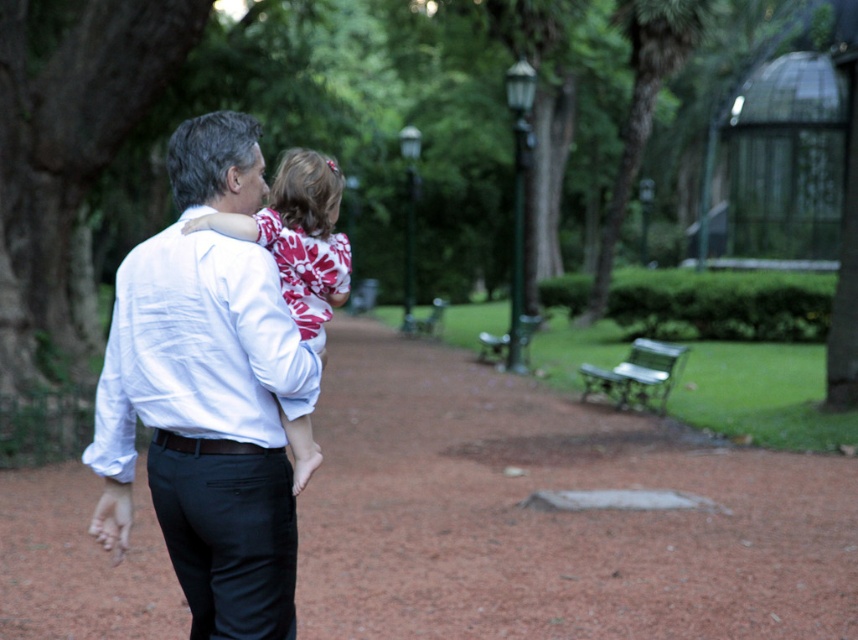
Does point (524, 326) come in front of point (420, 321)?

Yes, it is.

Is green metal bench at center below green wooden bench at center?

Indeed, green metal bench at center is positioned under green wooden bench at center.

This screenshot has height=640, width=858. What do you see at coordinates (493, 346) in the screenshot? I see `green metal bench at center` at bounding box center [493, 346].

Identify the location of green metal bench at center. (493, 346).

Between smooth dirt path at center and green metal bench at center, which one has more height?

smooth dirt path at center

Who is more forward, (x=544, y=564) or (x=509, y=340)?

Positioned in front is point (x=544, y=564).

Who is more forward, (589,579) or (521,349)?

Point (589,579)

This screenshot has height=640, width=858. What are the coordinates of `smooth dirt path at center` in the screenshot? It's located at (550, 513).

Can you confirm if white cotton shirt at center is taller than green wooden bench at center?

Indeed, white cotton shirt at center has a greater height compared to green wooden bench at center.

Between white cotton shirt at center and green wooden bench at center, which one is positioned lower?

white cotton shirt at center is below.

Find the location of a particular element. The width and height of the screenshot is (858, 640). white cotton shirt at center is located at coordinates (206, 424).